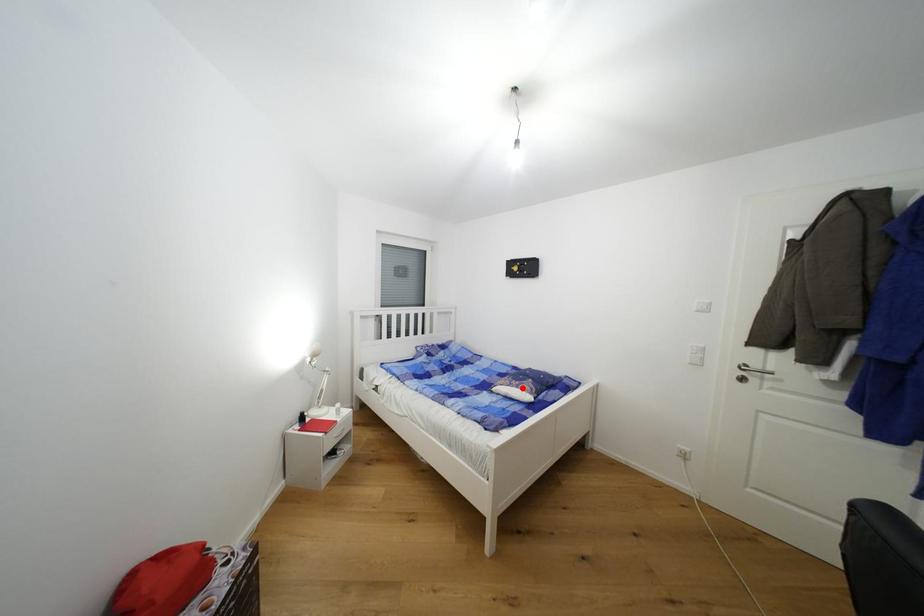
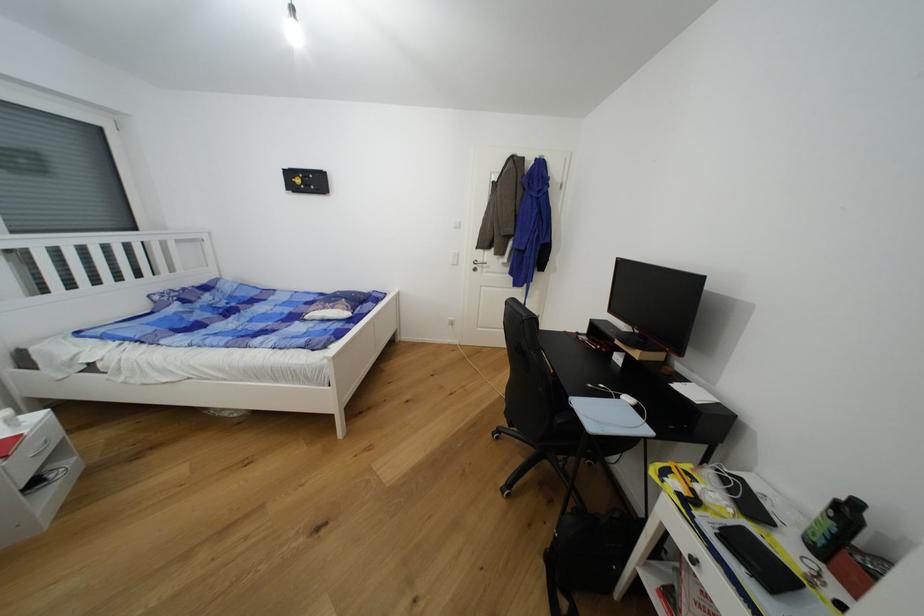
Locate, in the second image, the point that corresponds to the highlighted location in the first image.

(337, 310)